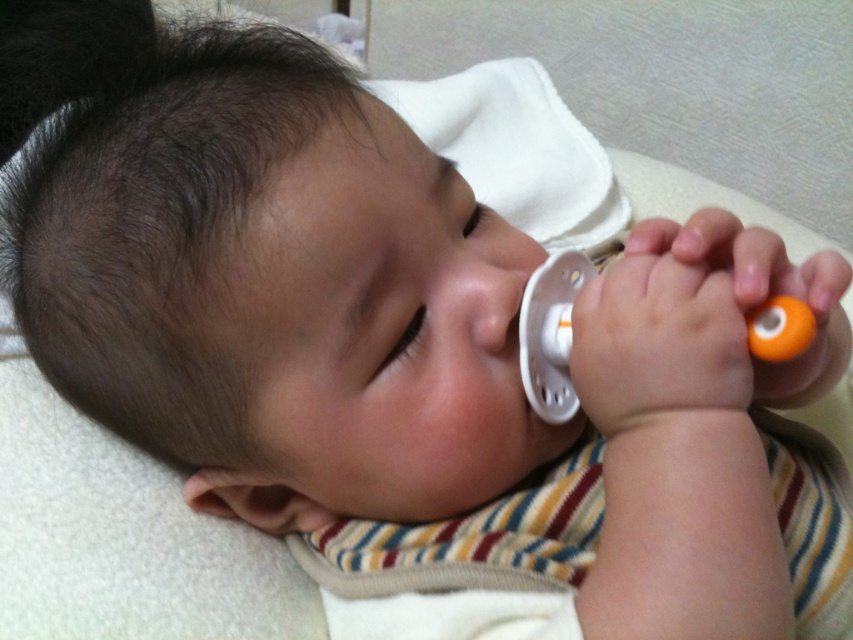
From the picture: Which is below, white plastic pacifier at right or white plastic pacifier at center?

white plastic pacifier at center

Is point (570, 296) positioned behind point (392, 352)?

That is True.

The height and width of the screenshot is (640, 853). Identify the location of white plastic pacifier at right. (552, 332).